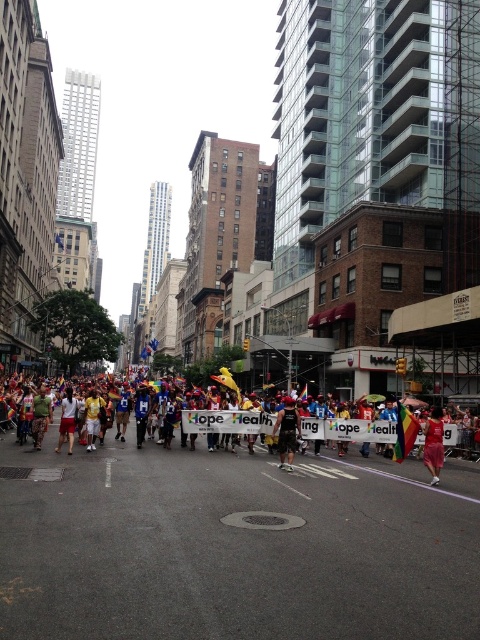
Does red satin dress at center appear over white cotton shorts at center?

No, red satin dress at center is not above white cotton shorts at center.

I want to click on red satin dress at center, so click(433, 444).

Is point (440, 412) more distant than point (72, 438)?

No, (440, 412) is closer to viewer.

This screenshot has height=640, width=480. I want to click on red satin dress at center, so click(433, 444).

From the picture: Which is below, red satin dress at center or multicolored fabric at center?

red satin dress at center is below.

Describe the element at coordinates (433, 444) in the screenshot. I see `red satin dress at center` at that location.

Where is `red satin dress at center`? This screenshot has width=480, height=640. red satin dress at center is located at coordinates (433, 444).

Who is positioned more to the right, multicolored fabric at center or white cotton shorts at center?

white cotton shorts at center

In order to click on multicolored fabric at center in this screenshot , I will do `click(40, 416)`.